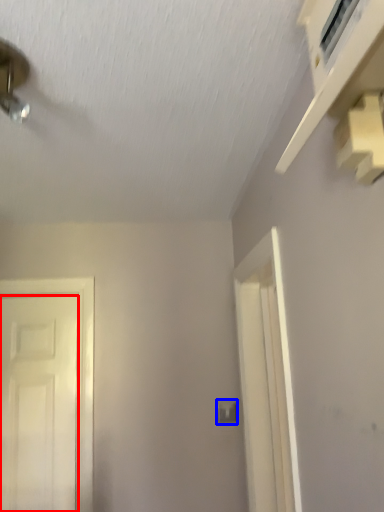
Question: Which object is closer to the camera taking this photo, door (highlighted by a red box) or light switch (highlighted by a blue box)?

Choices:
 (A) door
 (B) light switch

Answer: (A)